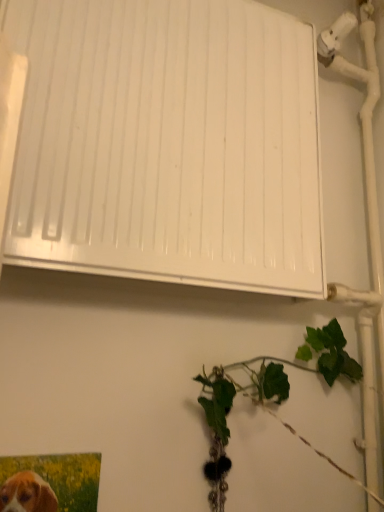
Describe the element at coordinates (62, 477) in the screenshot. The image size is (384, 512). I see `matte wooden picture frame at lower left` at that location.

In order to click on matte wooden picture frame at lower left in this screenshot , I will do `click(62, 477)`.

Locate an element on the screen. This screenshot has height=512, width=384. matte wooden picture frame at lower left is located at coordinates (62, 477).